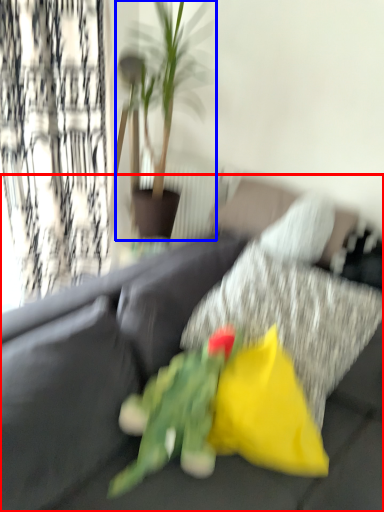
Question: Which object is closer to the camera taking this photo, studio couch (highlighted by a red box) or houseplant (highlighted by a blue box)?

Choices:
 (A) studio couch
 (B) houseplant

Answer: (A)